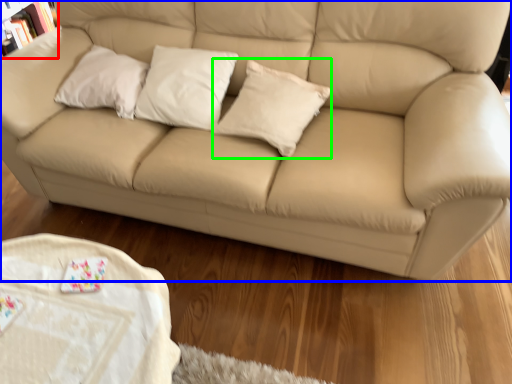
Question: Which object is the farthest from bookcase (highlighted by a red box)? Choose among these: studio couch (highlighted by a blue box) or pillow (highlighted by a green box).

Choices:
 (A) studio couch
 (B) pillow

Answer: (B)